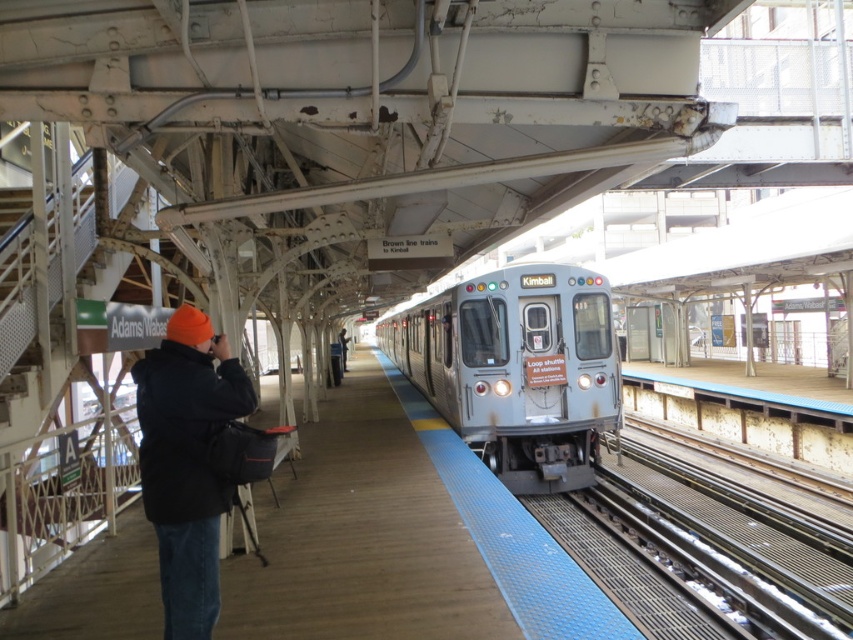
You are waiting for a train at the station and see the silver metallic train at center and the black jacket at center. Which object is located to the right of the other?

The silver metallic train at center is positioned on the right side of black jacket at center.